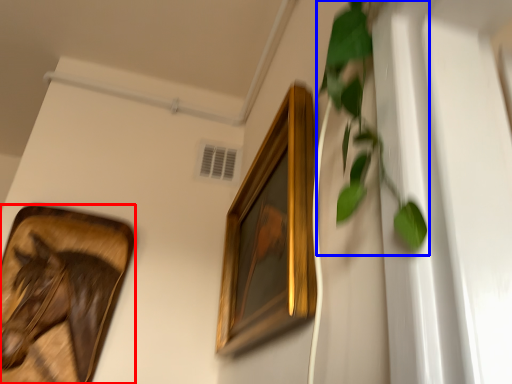
Question: Which point is closer to the camera, picture frame (highlighted by a red box) or vegetation (highlighted by a blue box)?

Choices:
 (A) picture frame
 (B) vegetation

Answer: (B)